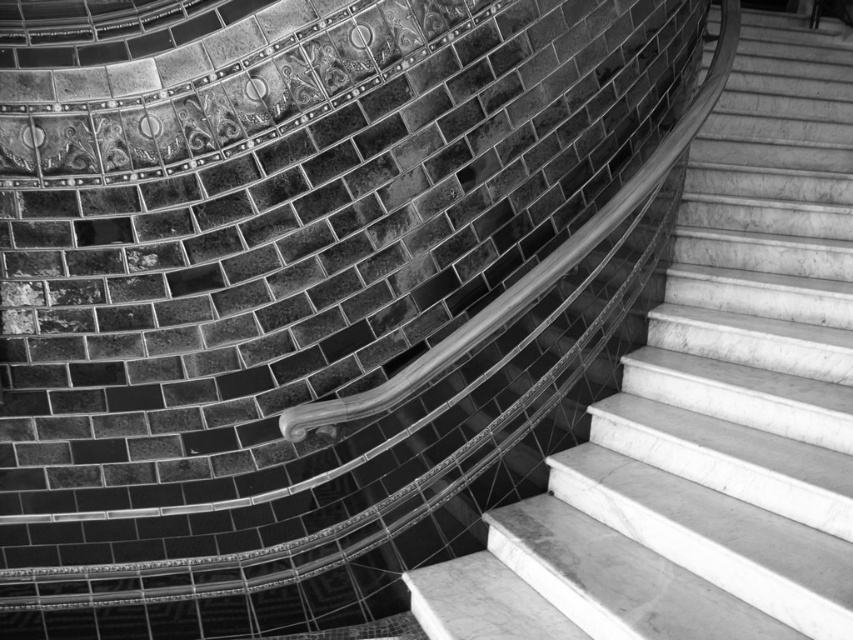
You are an architect designing a new staircase and want to ensure safety for users. Given the scene described, which object has a greater width between the white marble stairs at center and the metallic polished handrail at center?

The white marble stairs at center has a greater width than the metallic polished handrail at center, as stated in the description.

You are an architect analyzing the staircase design. Which object between the white marble stairs at center and the metallic polished handrail at center has a greater height?

The white marble stairs at center has a greater height compared to the metallic polished handrail at center.

You are standing at the bottom of the staircase in the image. There is a point marked at coordinates [708,403]. Is this point located on the white marble stairs at center?

Yes, the point [708,403] is located on the white marble stairs at center as stated in the objects description.